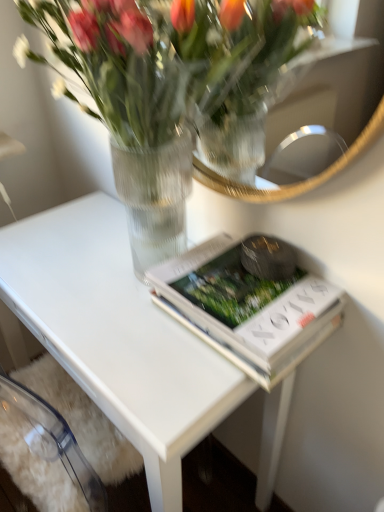
Question: From a real-world perspective, is white glossy table at center positioned over clear glass vase at upper center based on gravity?

Choices:
 (A) yes
 (B) no

Answer: (B)

Question: Considering the relative sizes of white glossy table at center and clear glass vase at upper center in the image provided, is white glossy table at center taller than clear glass vase at upper center?

Choices:
 (A) yes
 (B) no

Answer: (A)

Question: Is white glossy table at center far away from clear glass vase at upper center?

Choices:
 (A) yes
 (B) no

Answer: (B)

Question: Is white glossy table at center placed right next to clear glass vase at upper center?

Choices:
 (A) yes
 (B) no

Answer: (B)

Question: Is clear glass vase at upper center located within white glossy table at center?

Choices:
 (A) no
 (B) yes

Answer: (A)

Question: Is white glossy table at center to the right of clear glass vase at upper center from the viewer's perspective?

Choices:
 (A) no
 (B) yes

Answer: (A)

Question: From the image's perspective, is white glossy table at center on top of white matte book at center?

Choices:
 (A) yes
 (B) no

Answer: (B)

Question: Is white glossy table at center taller than white matte book at center?

Choices:
 (A) yes
 (B) no

Answer: (A)

Question: Is white glossy table at center surrounding white matte book at center?

Choices:
 (A) yes
 (B) no

Answer: (B)

Question: Is white glossy table at center oriented away from white matte book at center?

Choices:
 (A) no
 (B) yes

Answer: (A)

Question: Is the surface of white glossy table at center in direct contact with white matte book at center?

Choices:
 (A) no
 (B) yes

Answer: (A)

Question: From a real-world perspective, does white glossy table at center stand above white matte book at center?

Choices:
 (A) yes
 (B) no

Answer: (B)

Question: From the image's perspective, is white matte book at center above clear glass vase at upper center?

Choices:
 (A) yes
 (B) no

Answer: (B)